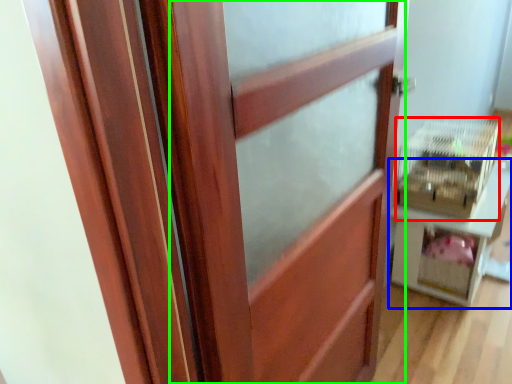
Question: Which is farther away from crate (highlighted by a red box)? furniture (highlighted by a blue box) or barn door (highlighted by a green box)?

Choices:
 (A) furniture
 (B) barn door

Answer: (B)